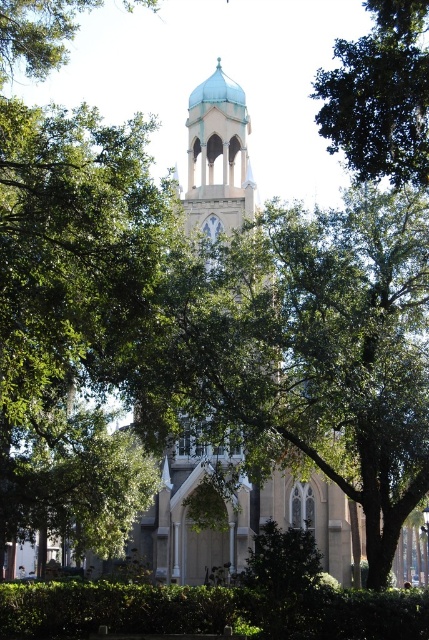
Who is more distant from viewer, (341, 92) or (205, 625)?

The point (205, 625) is more distant.

Between green leafy tree at upper right and green leafy hedge at lower center, which one appears on the left side from the viewer's perspective?

From the viewer's perspective, green leafy hedge at lower center appears more on the left side.

This screenshot has width=429, height=640. Identify the location of green leafy tree at upper right. (380, 96).

Consider the image. Who is higher up, light beige stone church at center or green leafy tree at upper right?

green leafy tree at upper right is higher up.

Is light beige stone church at center to the right of green leafy tree at upper right from the viewer's perspective?

No, light beige stone church at center is not to the right of green leafy tree at upper right.

The height and width of the screenshot is (640, 429). Describe the element at coordinates (241, 522) in the screenshot. I see `light beige stone church at center` at that location.

Locate an element on the screen. light beige stone church at center is located at coordinates (241, 522).

In the scene shown: Can you confirm if light beige stone church at center is positioned to the right of green leafy tree at upper left?

Indeed, light beige stone church at center is positioned on the right side of green leafy tree at upper left.

Between light beige stone church at center and green leafy tree at upper left, which one appears on the left side from the viewer's perspective?

From the viewer's perspective, green leafy tree at upper left appears more on the left side.

Is point (317, 499) positioned behind point (66, 4)?

Yes, point (317, 499) is behind point (66, 4).

This screenshot has height=640, width=429. In order to click on light beige stone church at center in this screenshot , I will do `click(241, 522)`.